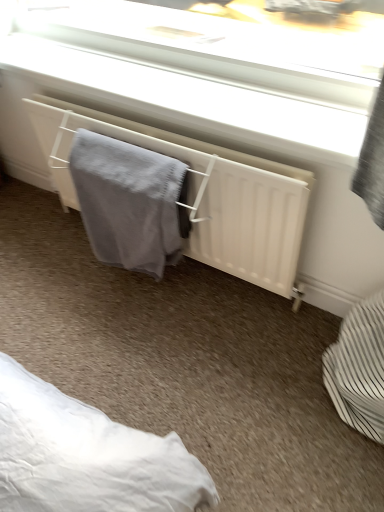
In order to click on gray knitted towel at center in this screenshot , I will do `click(130, 202)`.

You are a GUI agent. You are given a task and a screenshot of the screen. Output one action in this format:
    pyautogui.click(x=<x>, y=<y>)
    Task: Click on the gray knitted towel at center
    
    Given the screenshot: What is the action you would take?
    pyautogui.click(x=130, y=202)

Is white matte radiator at center not inside white striped basket at lower right?

Yes, white matte radiator at center is located beyond the bounds of white striped basket at lower right.

Measure the distance between white matte radiator at center and white striped basket at lower right.

white matte radiator at center and white striped basket at lower right are 19.34 inches apart.

Which of these two, white matte radiator at center or white striped basket at lower right, stands taller?

Standing taller between the two is white striped basket at lower right.

Can you confirm if white matte radiator at center is smaller than white striped basket at lower right?

Incorrect, white matte radiator at center is not smaller in size than white striped basket at lower right.

In the scene shown: Is gray knitted towel at center with white striped basket at lower right?

No, gray knitted towel at center is not making contact with white striped basket at lower right.

Is gray knitted towel at center to the left or to the right of white striped basket at lower right in the image?

Clearly, gray knitted towel at center is on the left of white striped basket at lower right in the image.

Is gray knitted towel at center oriented away from white striped basket at lower right?

No, gray knitted towel at center's orientation is not away from white striped basket at lower right.

Based on the photo, from the image's perspective, is gray knitted towel at center positioned above or below white striped basket at lower right?

Clearly, from the image's perspective, gray knitted towel at center is above white striped basket at lower right.

Are gray knitted towel at center and white matte radiator at center beside each other?

No, gray knitted towel at center is not in contact with white matte radiator at center.

In the scene shown: Is gray knitted towel at center aimed at white matte radiator at center?

Yes, gray knitted towel at center is turned towards white matte radiator at center.

Is gray knitted towel at center bigger than white matte radiator at center?

Actually, gray knitted towel at center might be smaller than white matte radiator at center.

From a real-world perspective, is gray knitted towel at center located beneath white matte radiator at center?

Correct, in the physical world, gray knitted towel at center is lower than white matte radiator at center.

Is white matte radiator at center further to the viewer compared to gray knitted towel at center?

No, white matte radiator at center is closer to the viewer.

In the scene shown: Between white matte radiator at center and gray knitted towel at center, which one has less height?

With less height is white matte radiator at center.

Would you say white matte radiator at center is outside gray knitted towel at center?

Yes, white matte radiator at center is outside of gray knitted towel at center.

In terms of width, does white matte radiator at center look wider or thinner when compared to gray knitted towel at center?

white matte radiator at center is wider than gray knitted towel at center.

Consider the image. From a real-world perspective, is white striped basket at lower right positioned over gray knitted towel at center based on gravity?

No, from a real-world perspective, white striped basket at lower right is not above gray knitted towel at center.

Consider the image. Which point is more distant from viewer, (336, 389) or (119, 174)?

The point (119, 174) is farther.

Would you say white striped basket at lower right contains gray knitted towel at center?

No, gray knitted towel at center is not a part of white striped basket at lower right.

From a real-world perspective, is white striped basket at lower right located higher than white matte radiator at center?

Incorrect, from a real-world perspective, white striped basket at lower right is lower than white matte radiator at center.

In the scene shown: Is white matte radiator at center at the back of white striped basket at lower right?

No, white matte radiator at center is not at the back of white striped basket at lower right.

From the image's perspective, which one is positioned higher, white striped basket at lower right or white matte radiator at center?

From the image's view, white matte radiator at center is above.

In terms of size, does white striped basket at lower right appear bigger or smaller than white matte radiator at center?

Considering their sizes, white striped basket at lower right takes up less space than white matte radiator at center.

Identify the location of furniture directly beneath the white matte radiator at center (from a real-world perspective). (359, 368).

Locate an element on the screen. Image resolution: width=384 pixels, height=512 pixels. bath towel lying on the left of white striped basket at lower right is located at coordinates (x=130, y=202).

From the image, which object appears to be farther from white matte radiator at center, gray knitted towel at center or white striped basket at lower right?

white striped basket at lower right is further to white matte radiator at center.

When comparing their distances from gray knitted towel at center, does white striped basket at lower right or white matte radiator at center seem further?

Among the two, white striped basket at lower right is located further to gray knitted towel at center.

Considering their positions, is gray knitted towel at center positioned further to white striped basket at lower right than white matte radiator at center?

Based on the image, gray knitted towel at center appears to be further to white striped basket at lower right.

Consider the image. Considering their positions, is white striped basket at lower right positioned further to white matte radiator at center than gray knitted towel at center?

white striped basket at lower right is positioned further to the anchor white matte radiator at center.

From the image, which object appears to be farther from white striped basket at lower right, white matte radiator at center or gray knitted towel at center?

gray knitted towel at center.

Which object lies nearer to the anchor point gray knitted towel at center, white matte radiator at center or white striped basket at lower right?

Based on the image, white matte radiator at center appears to be nearer to gray knitted towel at center.

Identify the location of radiator between gray knitted towel at center and white striped basket at lower right. The image size is (384, 512). (203, 194).